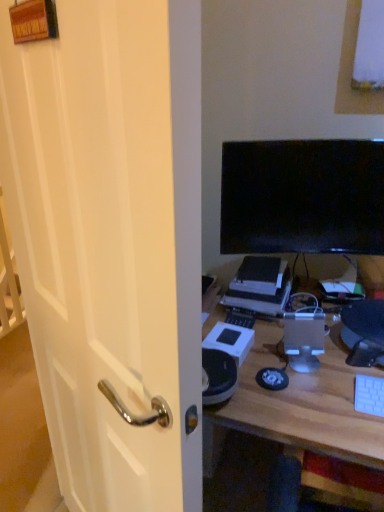
Question: Relative to satin silver computer tower at center, is black glossy screen at upper right in front or behind?

Choices:
 (A) front
 (B) behind

Answer: (B)

Question: Is black glossy screen at upper right taller or shorter than satin silver computer tower at center?

Choices:
 (A) short
 (B) tall

Answer: (B)

Question: Which object is positioned farthest from the white glossy door handle at left?

Choices:
 (A) black plastic printer at center
 (B) black glossy screen at upper right
 (C) satin silver computer tower at center
 (D) white plastic keyboard at lower right
 (E) white wood desk at center

Answer: (D)

Question: Which object is the farthest from the white plastic keyboard at lower right?

Choices:
 (A) white wood desk at center
 (B) black glossy screen at upper right
 (C) satin silver computer tower at center
 (D) black plastic printer at center
 (E) white glossy door handle at left

Answer: (E)